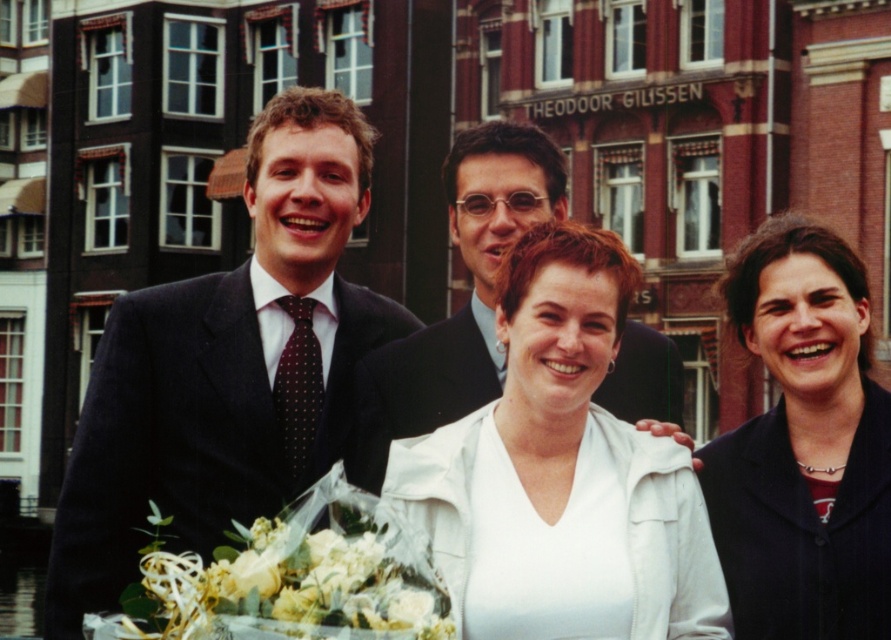
Is dark suit at center bigger than dark blue fabric at right?

Yes.

Which is behind, point (325, 428) or point (759, 492)?

The point (325, 428) is more distant.

Locate an element on the screen. dark suit at center is located at coordinates (226, 368).

Is white matte jacket at center in front of white floral bouquet at center?

That is False.

Consider the image. Can you confirm if white matte jacket at center is positioned below white floral bouquet at center?

No, white matte jacket at center is not below white floral bouquet at center.

The image size is (891, 640). What are the coordinates of `white matte jacket at center` in the screenshot? It's located at (562, 474).

Based on the photo, does dark suit at center appear under matte black suit at center?

Indeed, dark suit at center is positioned under matte black suit at center.

Between point (397, 310) and point (472, 353), which one is positioned behind?

Point (397, 310)

Which is behind, point (215, 317) or point (451, 336)?

Positioned behind is point (451, 336).

The width and height of the screenshot is (891, 640). What are the coordinates of `dark suit at center` in the screenshot? It's located at (226, 368).